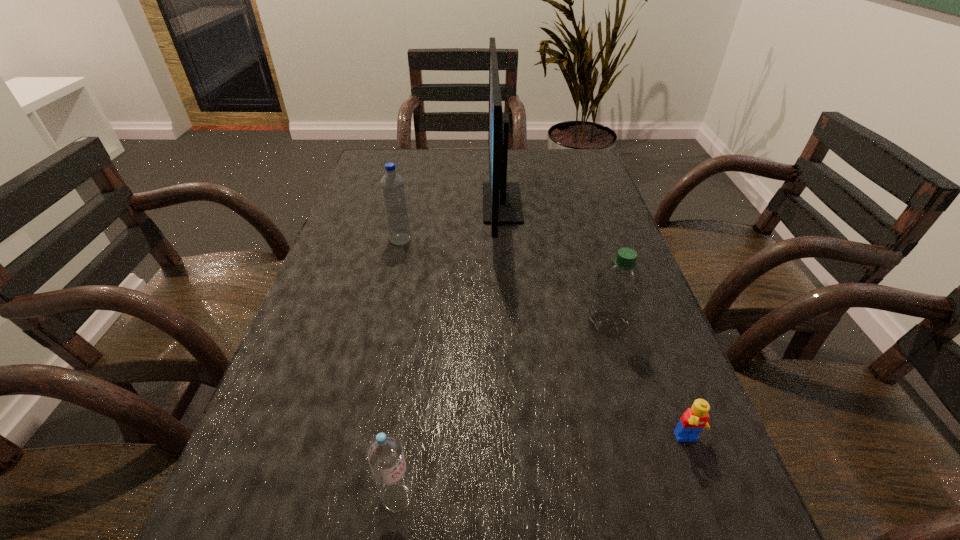
Where is `vacant space positioned on the screen side of the third object from left to right`? This screenshot has height=540, width=960. vacant space positioned on the screen side of the third object from left to right is located at coordinates (390, 203).

Where is `vacant space located on the screen side of the third object from left to right`? This screenshot has height=540, width=960. vacant space located on the screen side of the third object from left to right is located at coordinates (421, 203).

Where is `vacant position located 0.220m on the screen side of the third object from left to right`? This screenshot has width=960, height=540. vacant position located 0.220m on the screen side of the third object from left to right is located at coordinates (404, 203).

Where is `vacant region located 0.240m on the front of the leftmost object`? The image size is (960, 540). vacant region located 0.240m on the front of the leftmost object is located at coordinates (x=383, y=318).

Identify the location of free space located 0.180m on the front of the second object from right to left. This screenshot has height=540, width=960. (639, 427).

Where is `free spot located on the right of the second water bottle from left to right`? This screenshot has width=960, height=540. free spot located on the right of the second water bottle from left to right is located at coordinates (462, 497).

The height and width of the screenshot is (540, 960). I want to click on free space located 0.120m on the face of the rightmost object, so click(725, 537).

Identify the location of object located at the far edge. (502, 204).

Locate an element on the screen. object located at the left edge is located at coordinates (392, 184).

At what (x,y) coordinates should I click in order to perform the action: click on water bottle that is at the right edge. Please return your answer as a coordinate pair (x, y). This screenshot has height=540, width=960. Looking at the image, I should click on (618, 289).